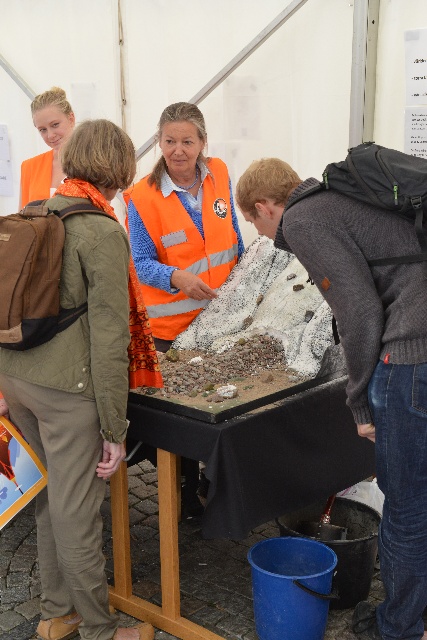
Does black fabric table at center have a greater width compared to matte orange vest at upper left?

Yes, black fabric table at center is wider than matte orange vest at upper left.

Is point (256, 467) positioned after point (43, 184)?

No, (256, 467) is in front of (43, 184).

Is point (306, 400) farther from viewer compared to point (52, 97)?

No, it is in front of (52, 97).

I want to click on black fabric table at center, so click(x=236, y=493).

Between black fabric table at center and reflective orange safety vest at center, which one is positioned higher?

reflective orange safety vest at center is above.

Does black fabric table at center have a greater width compared to reflective orange safety vest at center?

Indeed, black fabric table at center has a greater width compared to reflective orange safety vest at center.

Locate an element on the screen. This screenshot has width=427, height=640. black fabric table at center is located at coordinates (236, 493).

In the scene shown: Is knitted gray sweater at lower right to the left of reflective orange safety vest at center from the viewer's perspective?

Incorrect, knitted gray sweater at lower right is not on the left side of reflective orange safety vest at center.

Does point (421, 545) lie in front of point (173, 204)?

That is True.

You are a GUI agent. You are given a task and a screenshot of the screen. Output one action in this format:
    pyautogui.click(x=<x>, y=<y>)
    Task: Click on the knitted gray sweater at lower right
    This screenshot has width=427, height=640.
    Given the screenshot: What is the action you would take?
    pyautogui.click(x=366, y=353)